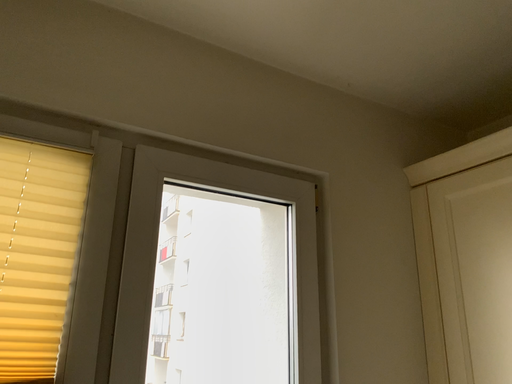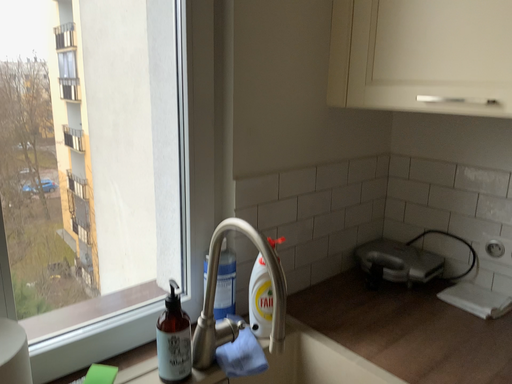
Question: Which way did the camera rotate in the video?

Choices:
 (A) rotated right
 (B) rotated left

Answer: (A)